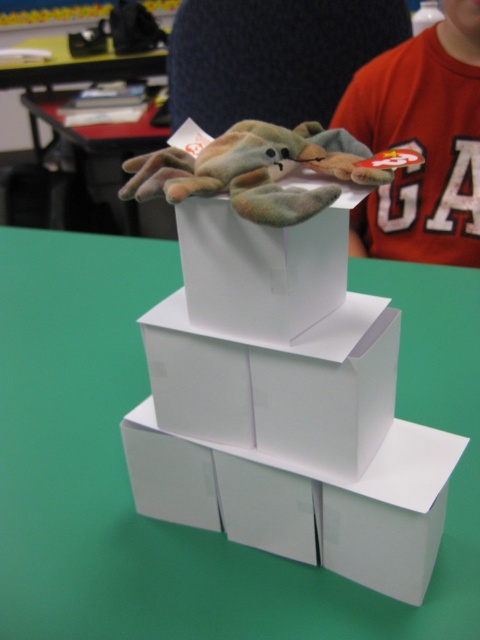
You are an observer looking at the scene. Which object is wider between the white cardboard boxes at center and the red cotton shirt at upper center?

The white cardboard boxes at center are wider than the red cotton shirt at upper center.

What is located at the coordinate point (127,472) in the image?

At point (127,472) lies white cardboard boxes at center.